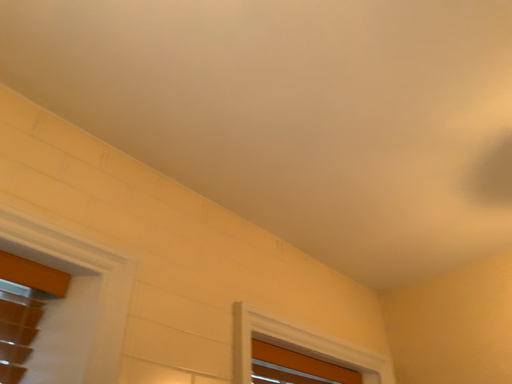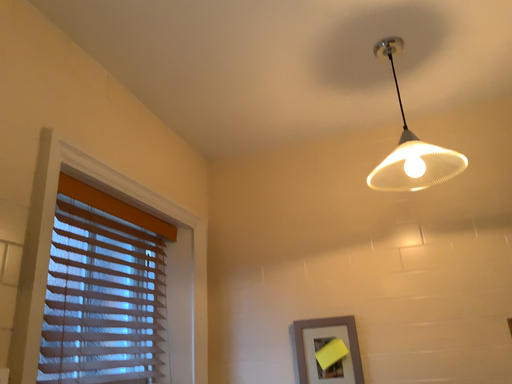
Question: How did the camera likely rotate when shooting the video?

Choices:
 (A) rotated upward
 (B) rotated downward

Answer: (B)